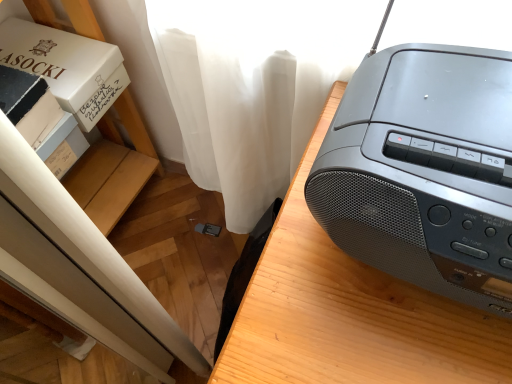
Locate an element on the screen. free space above matte black radio at upper right (from a real-world perspective) is located at coordinates (439, 122).